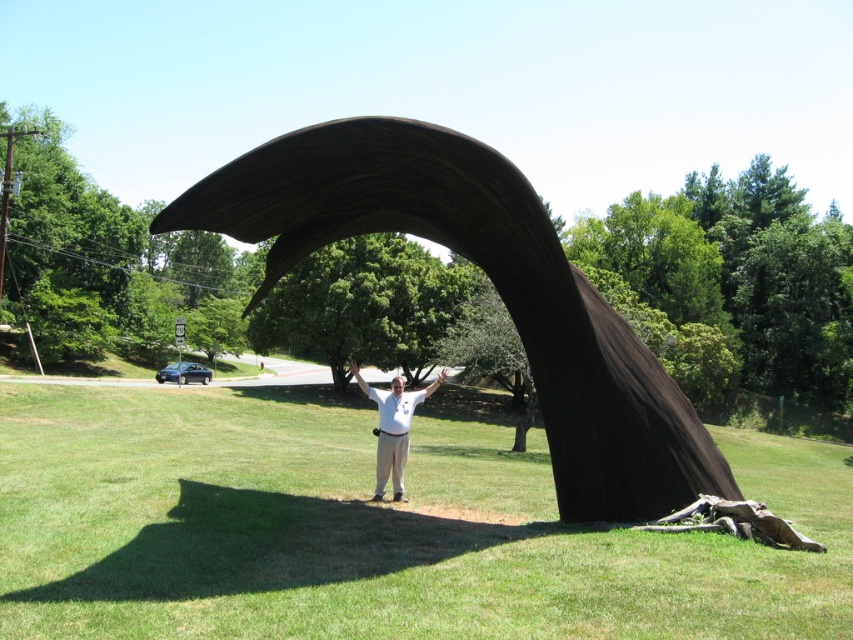
You are standing in front of the sculpture and want to take a photo of the black polished wood arch at center. Where should you position yourself to capture the arch at point (492, 284)?

The black polished wood arch at center is located at point (492, 284), so you should position yourself directly in front of that point to capture the arch at that location.

You are standing at the edge of the grassy area and want to take a photo of the large, dark sculpture while including the person in front of it. Since you want to ensure the entire sculpture and the person are in focus, what is the minimum distance you should be from the green grass at center to achieve this?

To ensure both the sculpture and the person in front of it are in focus, you should be at least 13.25 feet away from the green grass at center. This distance allows the camera to capture the depth required for both foreground and background elements to be sharp.